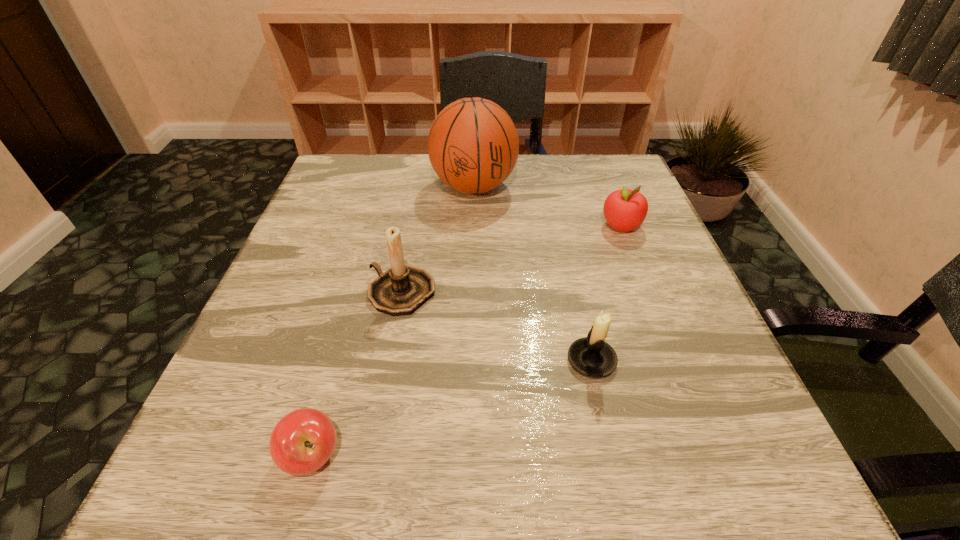
Where is `free space at the far edge of the desktop`? This screenshot has height=540, width=960. free space at the far edge of the desktop is located at coordinates pos(435,186).

Where is `vacant region at the left edge of the desktop`? This screenshot has height=540, width=960. vacant region at the left edge of the desktop is located at coordinates (365, 235).

The width and height of the screenshot is (960, 540). In the image, there is a desktop. In order to click on blank space at the right edge in this screenshot , I will do `click(711, 362)`.

I want to click on vacant space at the far left corner of the desktop, so click(x=330, y=181).

Where is `vacant region at the far right corner`? vacant region at the far right corner is located at coordinates (604, 185).

Locate an element on the screen. This screenshot has height=540, width=960. blank region between the third farthest object and the tallest object is located at coordinates (438, 240).

Where is `vacant space that's between the nearest object and the fourth nearest object`? vacant space that's between the nearest object and the fourth nearest object is located at coordinates (467, 341).

The height and width of the screenshot is (540, 960). Identify the location of unoccupied area between the basketball and the fourth shortest object. (438, 240).

Locate an element on the screen. The height and width of the screenshot is (540, 960). free spot between the third nearest object and the second object from right to left is located at coordinates (496, 326).

Find the location of `vacant area that lies between the second tallest object and the fourth farthest object`. vacant area that lies between the second tallest object and the fourth farthest object is located at coordinates (496, 326).